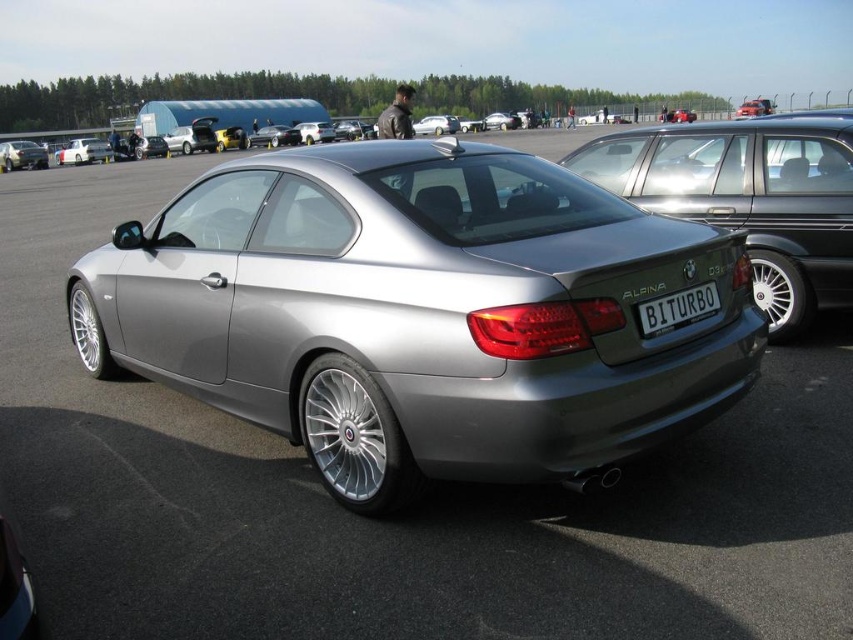
Question: Considering the relative positions of satin silver metallic car at center and silver metallic sedan at center in the image provided, where is satin silver metallic car at center located with respect to silver metallic sedan at center?

Choices:
 (A) below
 (B) above

Answer: (A)

Question: Does matte silver car at left lie in front of silver metallic sedan at center?

Choices:
 (A) yes
 (B) no

Answer: (A)

Question: Is satin silver metallic car at center smaller than white plastic license plate at rear?

Choices:
 (A) yes
 (B) no

Answer: (B)

Question: Estimate the real-world distances between objects in this image. Which object is farther from the white plastic license plate at rear?

Choices:
 (A) satin silver metallic car at center
 (B) matte silver car at left
 (C) silver metallic sedan at center

Answer: (C)

Question: Which point appears closest to the camera in this image?

Choices:
 (A) (672, 301)
 (B) (25, 150)
 (C) (80, 147)
 (D) (775, 196)

Answer: (A)

Question: Based on their relative distances, which object is farther from the silver metallic sedan at center?

Choices:
 (A) satin silver metallic car at center
 (B) white plastic license plate at rear

Answer: (B)